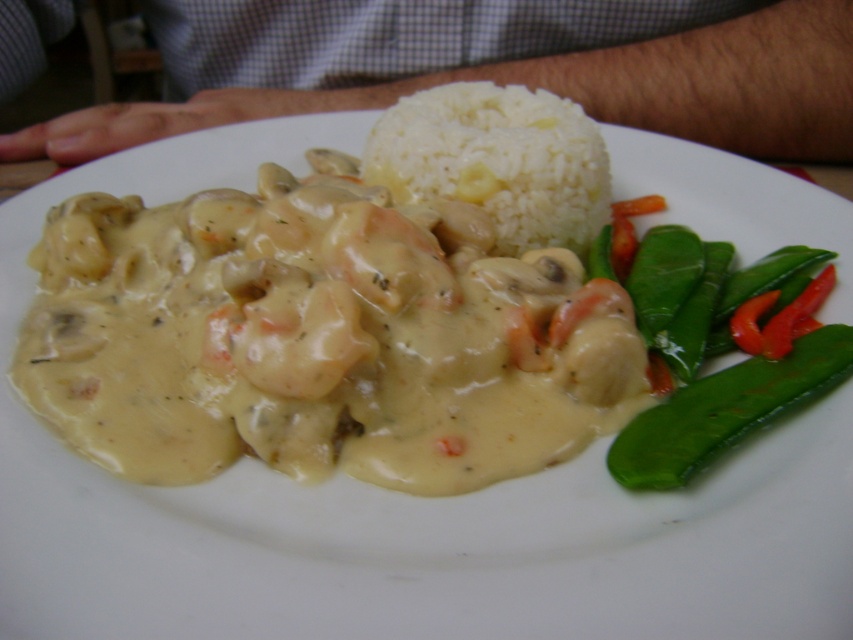
Does white matte rice at center have a lesser height compared to green smooth bean at lower right?

Incorrect, white matte rice at center's height does not fall short of green smooth bean at lower right's.

Can you confirm if white matte rice at center is bigger than green smooth bean at lower right?

Yes.

Is point (572, 116) positioned before point (634, 458)?

No, it is behind (634, 458).

I want to click on white matte rice at center, so click(x=497, y=161).